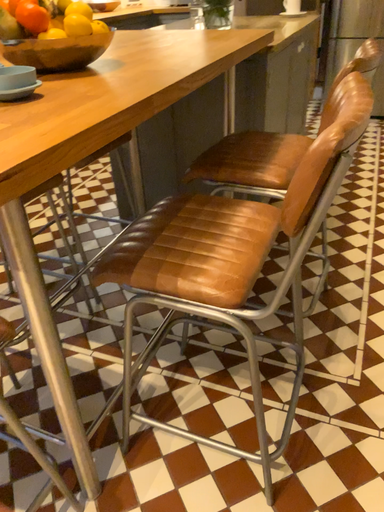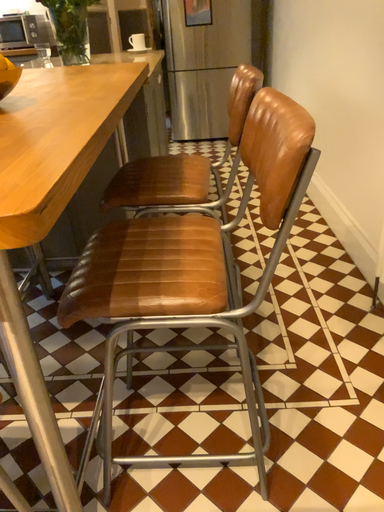
Question: Which way did the camera rotate in the video?

Choices:
 (A) rotated left
 (B) rotated right

Answer: (B)